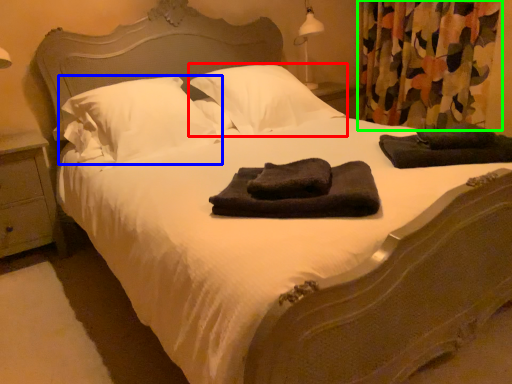
Question: Which object is positioned farthest from pillow (highlighted by a red box)? Select from pillow (highlighted by a blue box) and curtain (highlighted by a green box).

Choices:
 (A) pillow
 (B) curtain

Answer: (B)